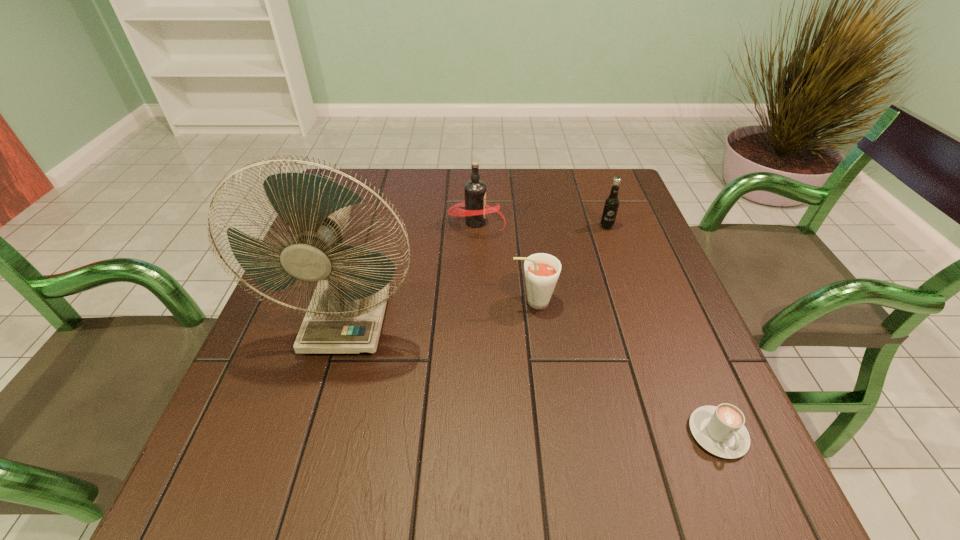
The image size is (960, 540). I want to click on vacant space at the right edge, so 620,253.

I want to click on vacant space at the near left corner of the desktop, so click(272, 512).

The width and height of the screenshot is (960, 540). What are the coordinates of `vacant space at the far right corner of the desktop` in the screenshot? It's located at (588, 200).

Where is `empty location between the tallest root beer and the nearest root beer`? The width and height of the screenshot is (960, 540). empty location between the tallest root beer and the nearest root beer is located at coordinates (505, 262).

You are a GUI agent. You are given a task and a screenshot of the screen. Output one action in this format:
    pyautogui.click(x=<x>, y=<y>)
    Task: Click on the vacant space that's between the rightmost root beer and the nearest object
    
    Given the screenshot: What is the action you would take?
    pos(662,330)

Find the location of a particular element. The height and width of the screenshot is (540, 960). vacant space in between the nearest root beer and the rightmost root beer is located at coordinates (569, 264).

The width and height of the screenshot is (960, 540). In order to click on vacant area that lies between the cappuccino and the nearest root beer in this screenshot , I will do `click(625, 367)`.

Locate an element on the screen. The width and height of the screenshot is (960, 540). free point between the nearest object and the tallest root beer is located at coordinates (597, 328).

Locate an element on the screen. Image resolution: width=960 pixels, height=540 pixels. blank region between the leftmost object and the nearest root beer is located at coordinates (441, 311).

At what (x,y) coordinates should I click in order to perform the action: click on free spot between the rightmost root beer and the nearest root beer. Please return your answer as a coordinate pair (x, y). The height and width of the screenshot is (540, 960). Looking at the image, I should click on (569, 264).